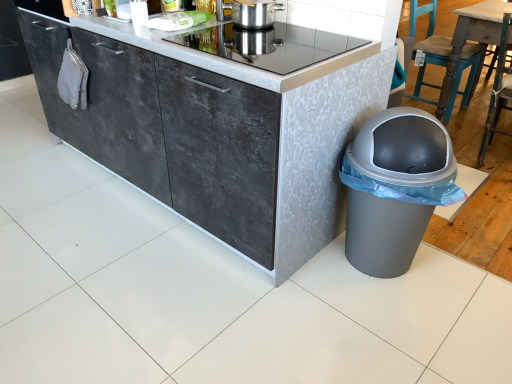
Question: From the image's perspective, is gray plastic trash can at lower right positioned above or below wooden chair at right, which ranks as the first chair in front-to-back order?

Choices:
 (A) below
 (B) above

Answer: (A)

Question: Based on their sizes in the image, would you say gray plastic trash can at lower right is bigger or smaller than wooden chair at right, the 2th chair from the back?

Choices:
 (A) small
 (B) big

Answer: (A)

Question: Estimate the real-world distances between objects in this image. Which object is closer to the stainless steel pot at upper center?

Choices:
 (A) dark gray concrete cabinet at center
 (B) wooden chair at right, the 2th chair from the back
 (C) teal painted wood chair at right, positioned as the 2th chair in front-to-back order
 (D) metallic glass cooktop at center
 (E) gray plastic trash can at lower right

Answer: (D)

Question: Estimate the real-world distances between objects in this image. Which object is farther from the teal painted wood chair at right, which is the 1th chair from back to front?

Choices:
 (A) wooden chair at right, the 2th chair from the back
 (B) stainless steel pot at upper center
 (C) metallic glass cooktop at center
 (D) gray plastic trash can at lower right
 (E) dark gray concrete cabinet at center

Answer: (E)